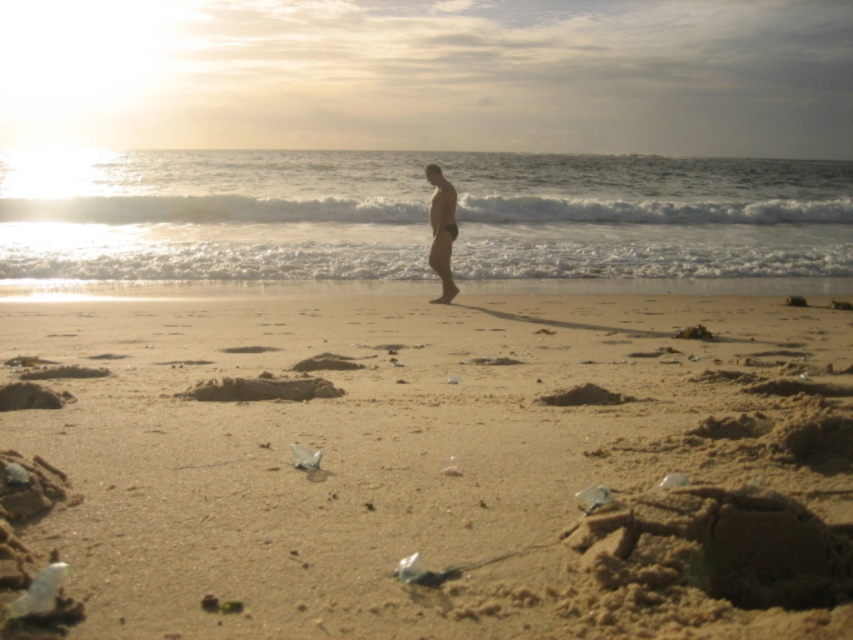
You are standing on the beach and see the brown sandy beach at center and the matte black swim trunks at center. Which object is positioned to the right of the other?

The brown sandy beach at center is to the right of the matte black swim trunks at center.

What are the coordinates of the brown sandy beach at center in the image?

The brown sandy beach at center is located at coordinates point (448,467).